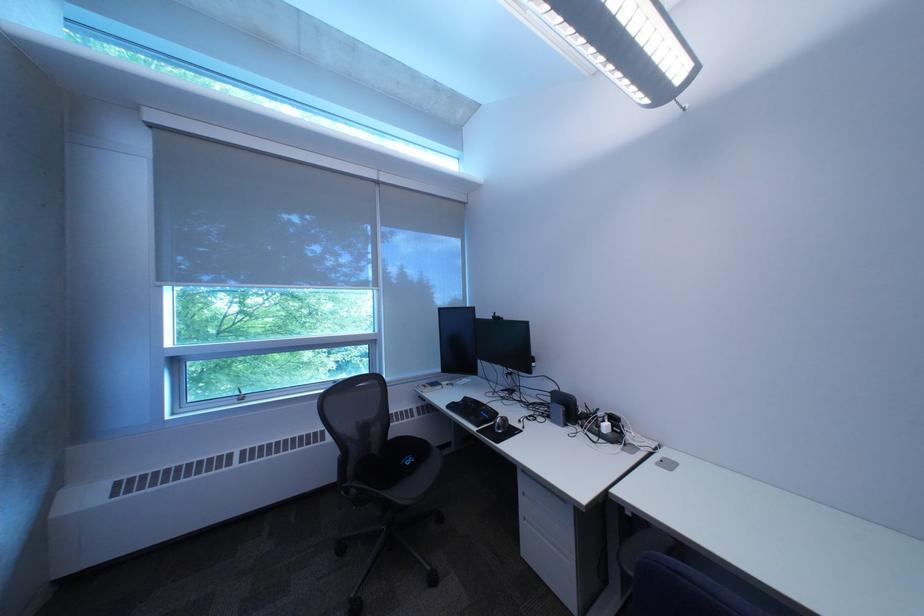
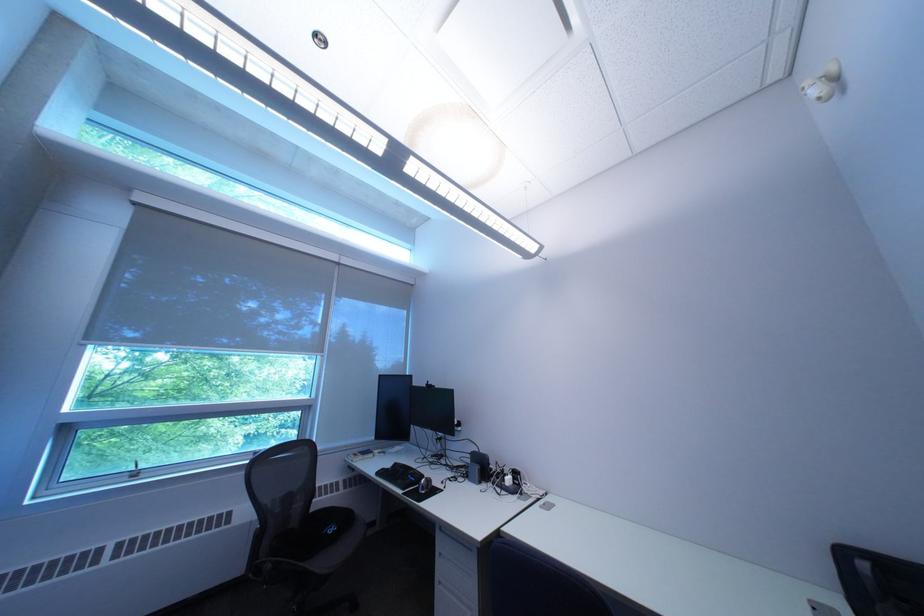
Where in the second image is the point corresponding to pixel 464 408 from the first image?

(393, 475)